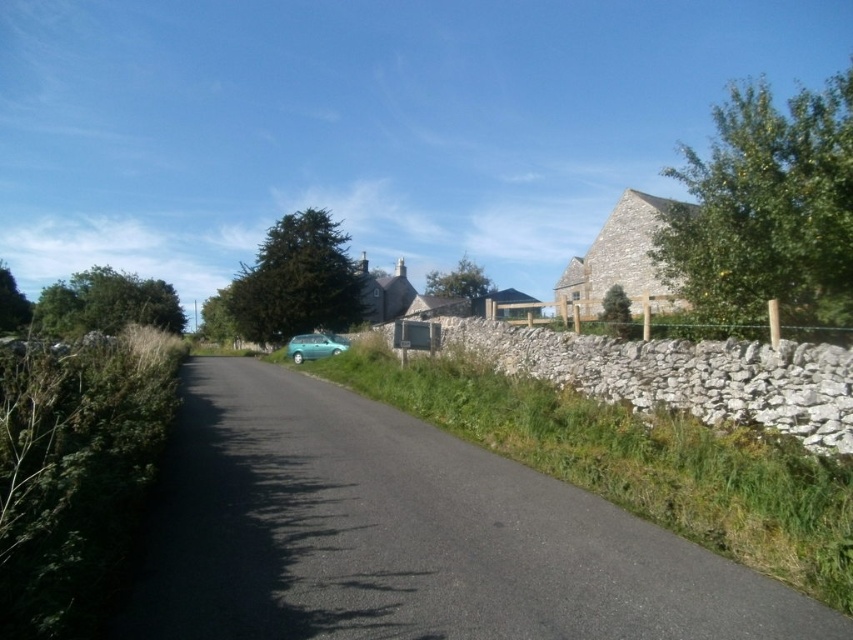
Question: Where is asphalt road at center located in relation to teal matte hatchback at center in the image?

Choices:
 (A) above
 (B) below

Answer: (B)

Question: Considering the relative positions of asphalt road at center and teal matte hatchback at center in the image provided, where is asphalt road at center located with respect to teal matte hatchback at center?

Choices:
 (A) above
 (B) below

Answer: (B)

Question: Does asphalt road at center appear under teal matte hatchback at center?

Choices:
 (A) no
 (B) yes

Answer: (B)